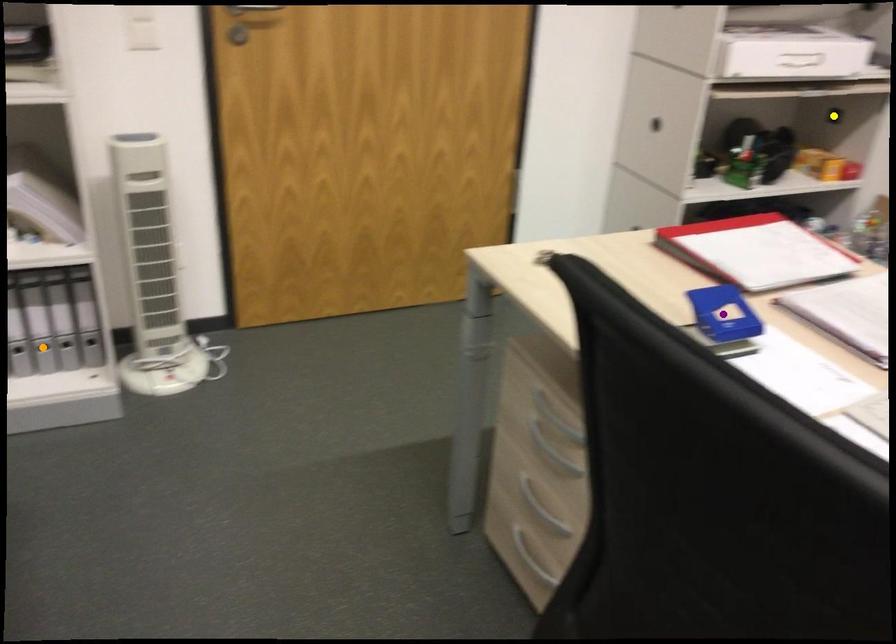
Order these from farthest to nearest:
1. yellow point
2. purple point
3. orange point

yellow point < orange point < purple point